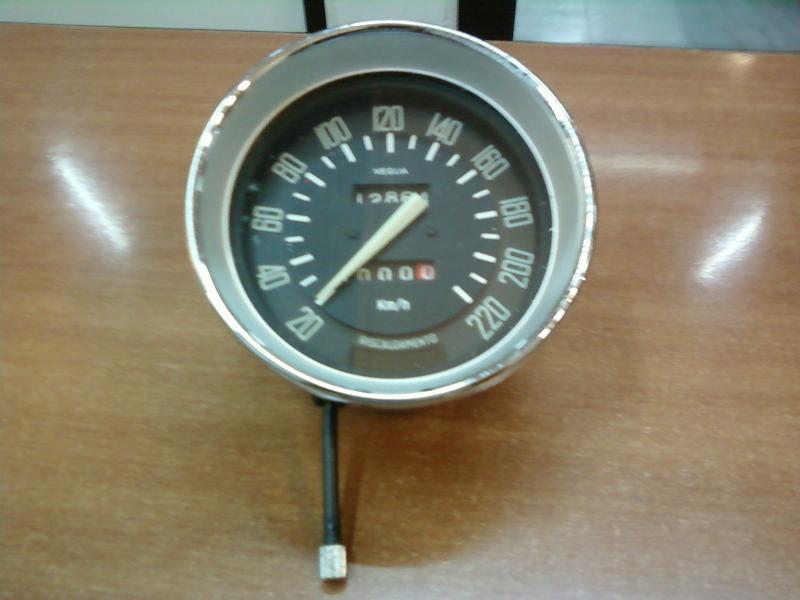
Identify the location of floor. (590, 13).